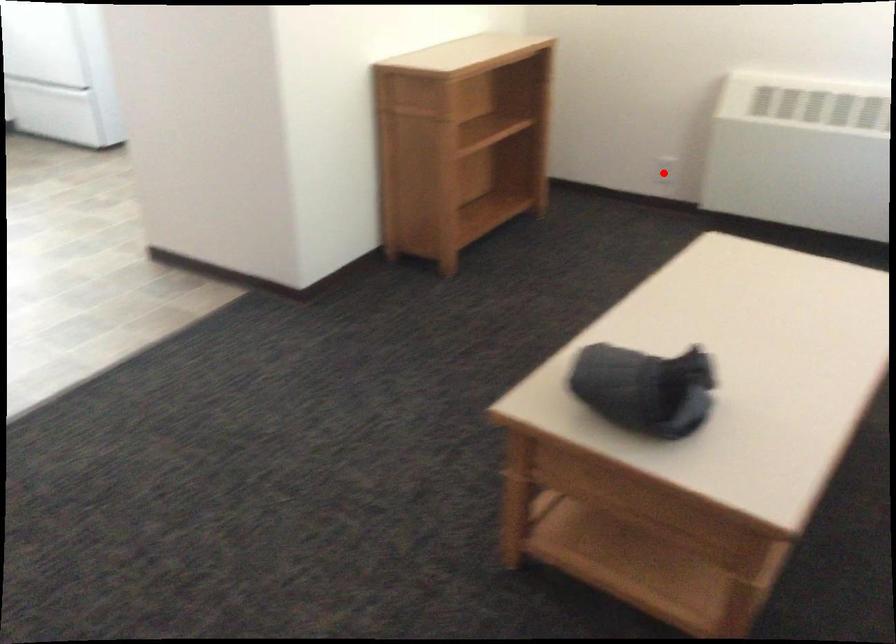
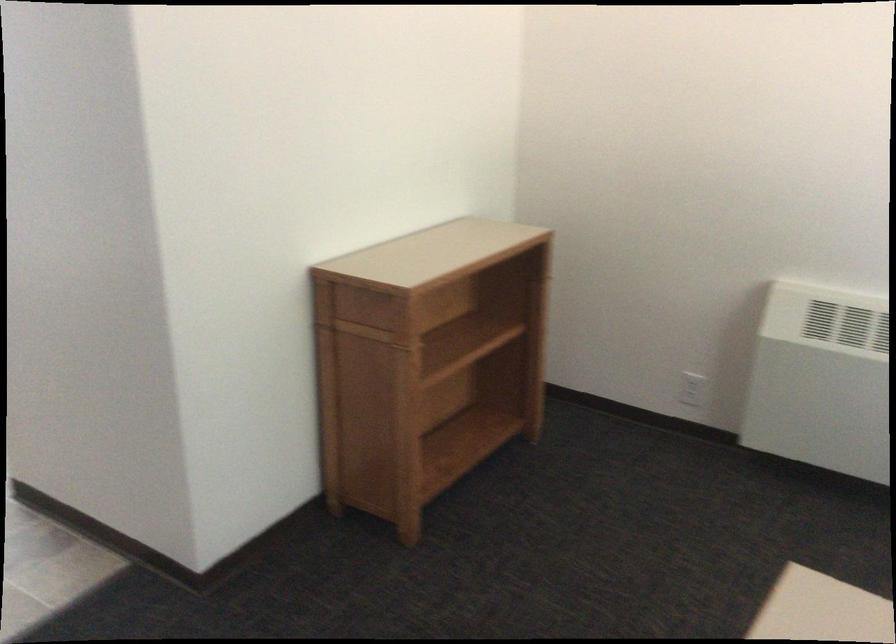
Question: I am providing you with two images of the same scene from different viewpoints. Given a red point in image1, look at the same physical point in image2. Is it:

Choices:
 (A) Closer to the viewpoint
 (B) Farther from the viewpoint

Answer: (A)